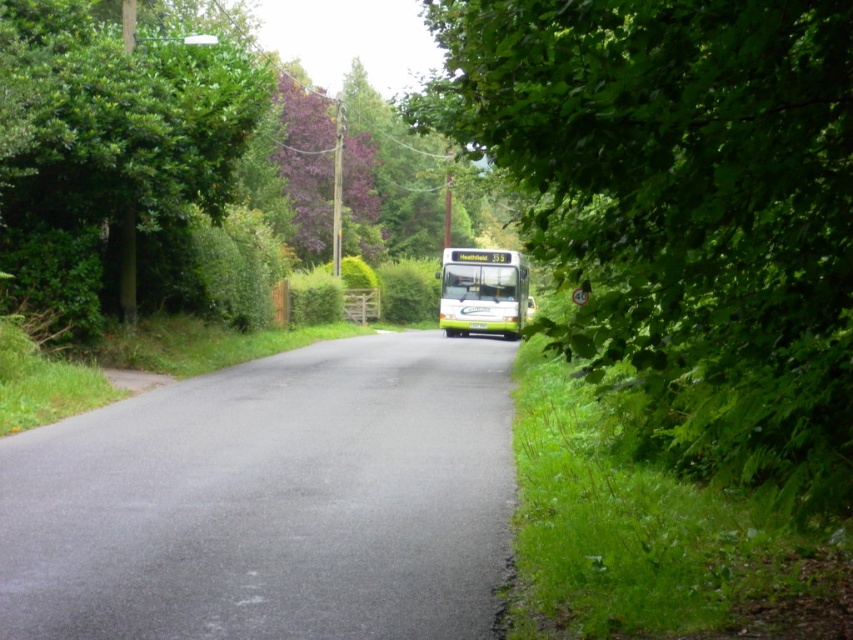
Does green leafy tree at center appear under green leafy tree at left?

Incorrect, green leafy tree at center is not positioned below green leafy tree at left.

Which is below, green leafy tree at center or green leafy tree at left?

Positioned lower is green leafy tree at left.

Does point (653, 164) come closer to viewer compared to point (186, 282)?

That is True.

Locate an element on the screen. This screenshot has height=640, width=853. green leafy tree at center is located at coordinates (682, 209).

Is green leafy tree at center behind green matte bus at center?

That is False.

Which is below, green leafy tree at center or green matte bus at center?

Positioned lower is green matte bus at center.

Does point (821, 467) come farther from viewer compared to point (450, 269)?

That is False.

The height and width of the screenshot is (640, 853). I want to click on green leafy tree at center, so [682, 209].

Is point (241, 129) more distant than point (473, 257)?

No, (241, 129) is closer to viewer.

Is green leafy tree at left taller than green matte bus at center?

No.

Between point (199, 189) and point (444, 326), which one is positioned in front?

Point (199, 189) is in front.

Locate an element on the screen. green leafy tree at left is located at coordinates (112, 154).